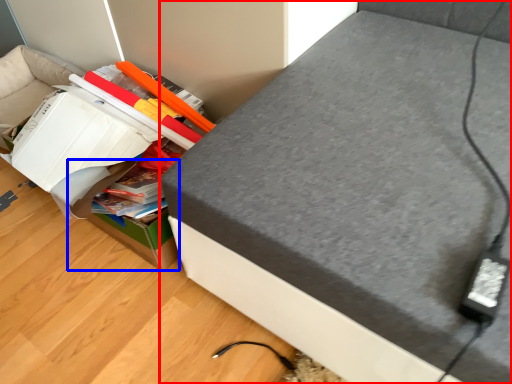
Question: Which of the following is the farthest to the observer, furniture (highlighted by a red box) or cardboard box (highlighted by a blue box)?

Choices:
 (A) furniture
 (B) cardboard box

Answer: (B)